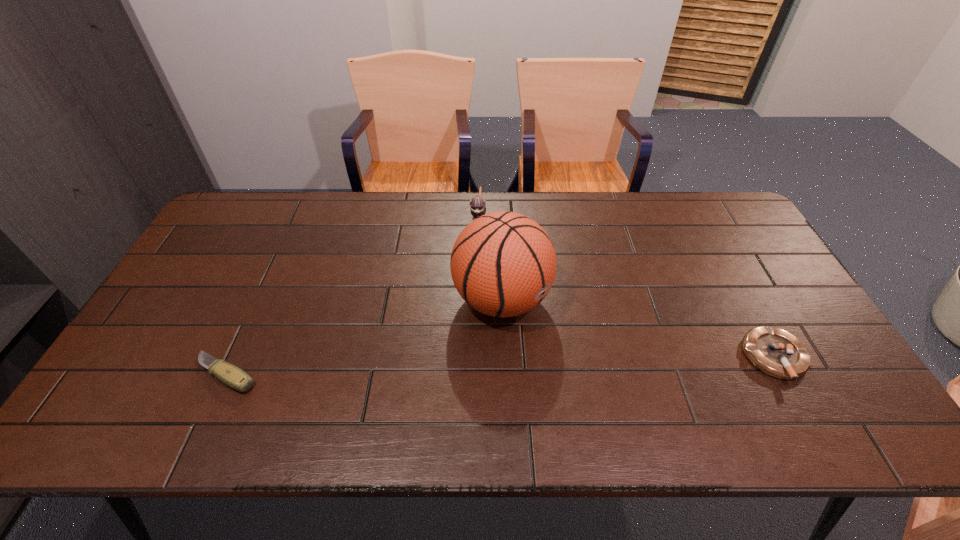
Locate an element on the screen. The image size is (960, 540). pocketknife is located at coordinates (232, 376).

In order to click on the shortest object in this screenshot , I will do `click(232, 376)`.

Where is `the rightmost object`? The image size is (960, 540). the rightmost object is located at coordinates (777, 353).

Locate an element on the screen. the third tallest object is located at coordinates pyautogui.click(x=777, y=353).

The width and height of the screenshot is (960, 540). Identify the location of kitten. (478, 208).

Locate an element on the screen. the second tallest object is located at coordinates (478, 208).

Image resolution: width=960 pixels, height=540 pixels. In order to click on basketball in this screenshot , I will do `click(503, 264)`.

I want to click on blank space located on the right of the shortest object, so click(285, 374).

I want to click on vacant space positioned on the left of the rightmost object, so click(x=712, y=357).

Image resolution: width=960 pixels, height=540 pixels. In order to click on free space located 0.160m on the front-facing side of the farthest object in this screenshot , I will do `click(473, 265)`.